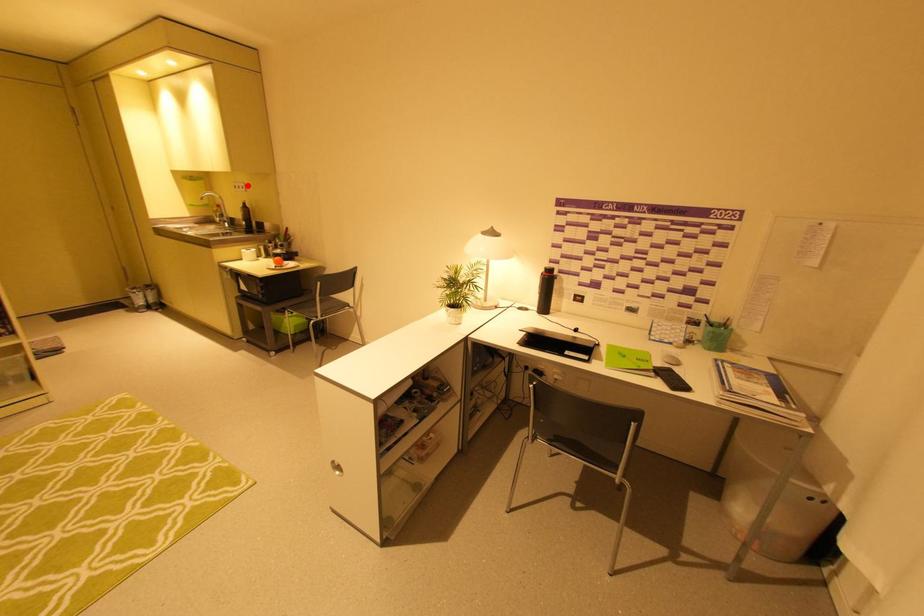
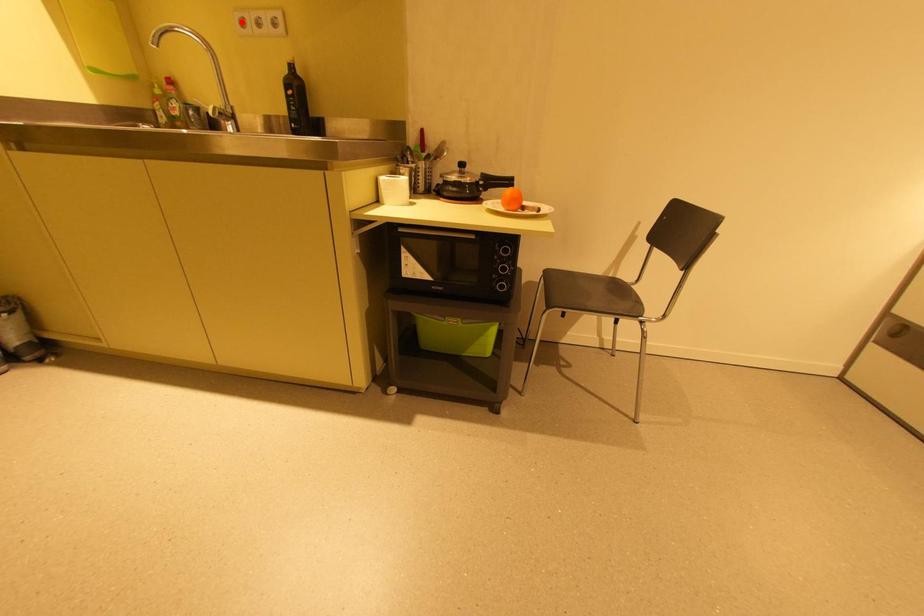
I am providing you with two images of the same scene from different viewpoints. A red point is marked on the first image and another point is marked on the second image. Do the highlighted points in image1 and image2 indicate the same real-world spot?

No